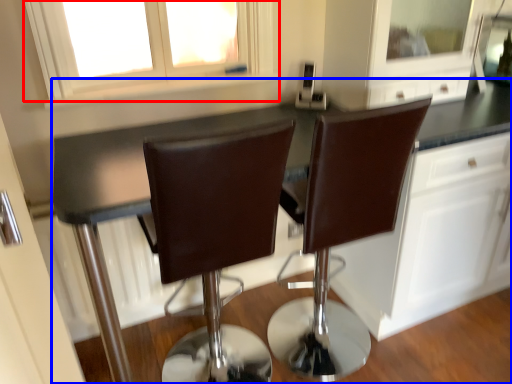
Question: Which object is further to the camera taking this photo, window (highlighted by a red box) or countertop (highlighted by a blue box)?

Choices:
 (A) window
 (B) countertop

Answer: (A)